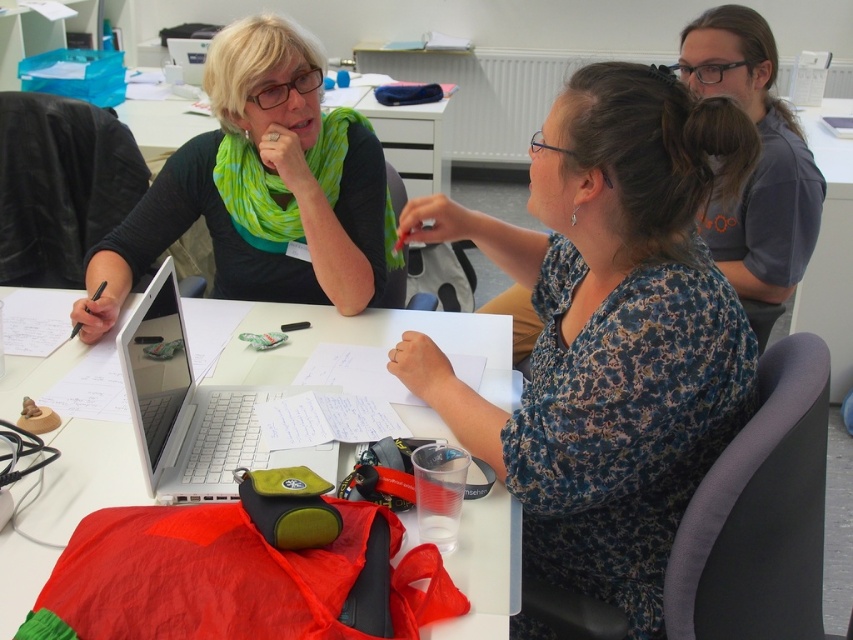
Consider the image. You are organizing a presentation and need to place a matte black laptop at left and a white paper at center on a desk. Considering their heights, which object will require more vertical space?

The matte black laptop at left requires more vertical space because it is much taller than the white paper at center.